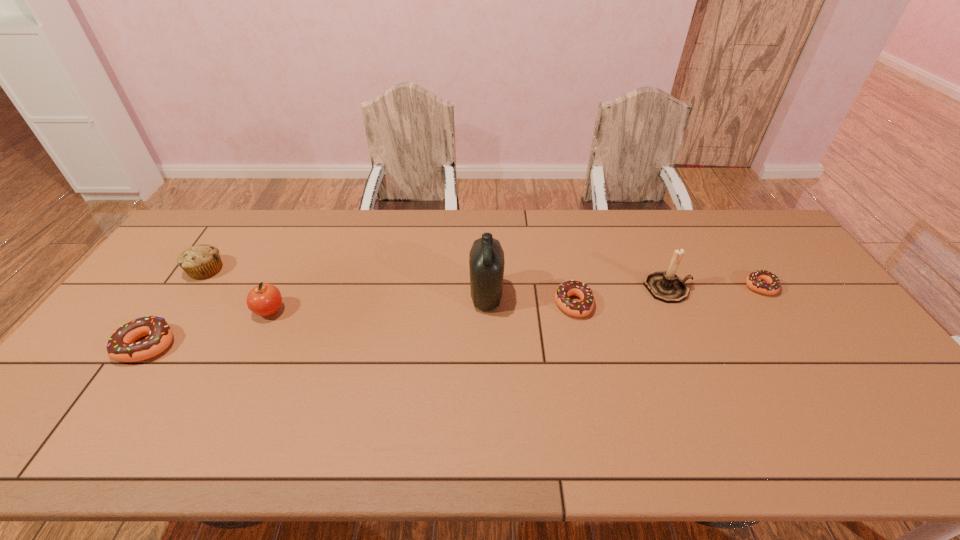
You are a GUI agent. You are given a task and a screenshot of the screen. Output one action in this format:
    pyautogui.click(x=<x>, y=<y>)
    Task: Click on the third object from left to right
    The image size is (960, 540).
    Given the screenshot: What is the action you would take?
    265,300

What are the coordinates of `candle holder` in the screenshot? It's located at 666,286.

The height and width of the screenshot is (540, 960). I want to click on the second tallest object, so click(x=666, y=286).

Where is `free space located on the right of the tallest doughnut`? The height and width of the screenshot is (540, 960). free space located on the right of the tallest doughnut is located at coordinates (220, 345).

Find the location of a particular element. The height and width of the screenshot is (540, 960). blank space located 0.330m on the back of the fifth object from left to right is located at coordinates (557, 225).

Locate an element on the screen. This screenshot has width=960, height=540. blank space located 0.280m on the back of the shortest object is located at coordinates (718, 223).

What are the coordinates of `vacant space positioned 0.360m on the front of the muffin` in the screenshot? It's located at (131, 382).

The width and height of the screenshot is (960, 540). What are the coordinates of `free space located 0.360m on the back of the fourth object from right to left` in the screenshot? It's located at [x=485, y=213].

Locate an element on the screen. The image size is (960, 540). vacant point located on the left of the apple is located at coordinates (168, 311).

The height and width of the screenshot is (540, 960). I want to click on vacant position located 0.050m on the left of the candle holder, so click(628, 288).